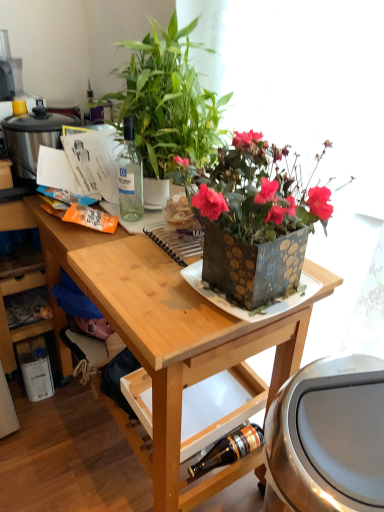
Question: Considering the relative sizes of stainless steel rice cooker at left, the 2th appliance in the bottom-to-top sequence, and brushed metal trash can at lower right, which is the 1th appliance from bottom to top, in the image provided, is stainless steel rice cooker at left, the 2th appliance in the bottom-to-top sequence, wider than brushed metal trash can at lower right, which is the 1th appliance from bottom to top,?

Choices:
 (A) yes
 (B) no

Answer: (B)

Question: From a real-world perspective, is stainless steel rice cooker at left, the 1th appliance when ordered from top to bottom, below brushed metal trash can at lower right, placed as the 2th appliance when sorted from back to front?

Choices:
 (A) yes
 (B) no

Answer: (B)

Question: Is stainless steel rice cooker at left, the 2th appliance in the bottom-to-top sequence, thinner than brushed metal trash can at lower right, placed as the second appliance when sorted from left to right?

Choices:
 (A) yes
 (B) no

Answer: (A)

Question: From a real-world perspective, is stainless steel rice cooker at left, which ranks as the 1th appliance in back-to-front order, physically above brushed metal trash can at lower right, which is the first appliance in front-to-back order?

Choices:
 (A) yes
 (B) no

Answer: (A)

Question: Is stainless steel rice cooker at left, the 2th appliance in the bottom-to-top sequence, oriented away from brushed metal trash can at lower right, placed as the 2th appliance when sorted from back to front?

Choices:
 (A) no
 (B) yes

Answer: (A)

Question: Choose the correct answer: Is metallic square plate at center inside wooden desk at center or outside it?

Choices:
 (A) outside
 (B) inside

Answer: (B)

Question: Looking at the image, does metallic square plate at center seem bigger or smaller compared to wooden desk at center?

Choices:
 (A) small
 (B) big

Answer: (A)

Question: Considering the relative positions of metallic square plate at center and wooden desk at center in the image provided, is metallic square plate at center to the left or to the right of wooden desk at center?

Choices:
 (A) right
 (B) left

Answer: (A)

Question: From the image's perspective, is metallic square plate at center above or below wooden desk at center?

Choices:
 (A) above
 (B) below

Answer: (A)

Question: Considering the relative positions of wooden desk at center and metallic square plate at center in the image provided, is wooden desk at center to the left or to the right of metallic square plate at center?

Choices:
 (A) left
 (B) right

Answer: (A)

Question: From a real-world perspective, is wooden desk at center physically located above or below metallic square plate at center?

Choices:
 (A) below
 (B) above

Answer: (A)

Question: In the image, is wooden desk at center positioned in front of or behind metallic square plate at center?

Choices:
 (A) behind
 (B) front

Answer: (B)

Question: Looking at the image, does wooden desk at center seem bigger or smaller compared to metallic square plate at center?

Choices:
 (A) big
 (B) small

Answer: (A)

Question: From a real-world perspective, is transparent glass bottle at upper left, the 2th bottle from the bottom, above or below brushed metal trash can at lower right, placed as the second appliance when sorted from left to right?

Choices:
 (A) above
 (B) below

Answer: (A)

Question: Considering their positions, is transparent glass bottle at upper left, the 2th bottle from the bottom, located in front of or behind brushed metal trash can at lower right, the first appliance when ordered from right to left?

Choices:
 (A) behind
 (B) front

Answer: (A)